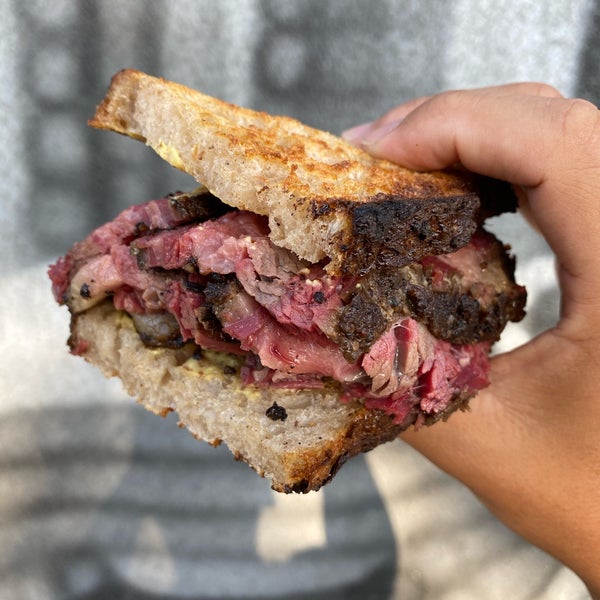
Locate an element on the screen. floor is located at coordinates (91, 570).